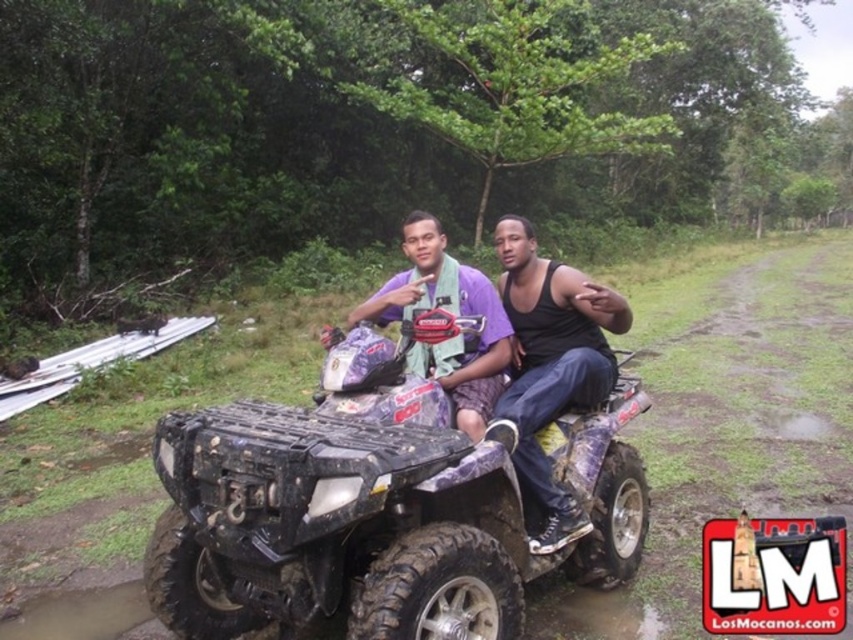
From the picture: You are a photographer trying to capture a closeup shot of both the black matte tank top at center and the purple matte shirt at center. The camera you have can only focus on objects within a 12 inch range. Do you think you can get both in focus?

The black matte tank top at center is 12.56 inches from the purple matte shirt at center. Since the camera can only focus within a 12 inch range, the distance between them exceeds the camera focus range. Therefore, you cannot get both in focus.

Looking at this image, you are standing at the camera position and want to reach the point at coordinates point (546, 508). If you can walk 2 meters per second, how many seconds will it take you to reach that point?

The distance of point (546, 508) from camera is 3.04 meters. At a walking speed of 2 meters per second, it would take approximately 1.52 seconds to reach that point.

You are designing a safety barrier that needs to be placed between the matte purple quad bike at center and the black matte tank top at center to ensure a minimum distance of 4 inches. Based on the current separation between them, is the barrier necessary?

The matte purple quad bike at center and the black matte tank top at center are currently 3.70 inches apart, which is less than the required 4 inches. Therefore, the safety barrier is necessary to maintain the minimum distance.